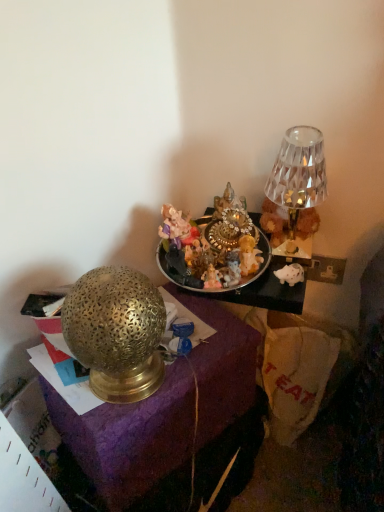
The image size is (384, 512). Describe the element at coordinates (134, 444) in the screenshot. I see `gold textured lamp at left` at that location.

Locate an element on the screen. The image size is (384, 512). gold textured lamp at left is located at coordinates (134, 444).

Is shiny metallic tray at center inside or outside of crystal glass lamp at upper right?

shiny metallic tray at center lies outside crystal glass lamp at upper right.

Which is more to the right, shiny metallic tray at center or crystal glass lamp at upper right?

Positioned to the right is crystal glass lamp at upper right.

Based on the photo, from the image's perspective, is shiny metallic tray at center located above crystal glass lamp at upper right?

No.

Is gold textured lamp at left smaller than shiny metallic tray at center?

Actually, gold textured lamp at left might be larger than shiny metallic tray at center.

Between gold textured lamp at left and shiny metallic tray at center, which one has smaller width?

shiny metallic tray at center.

How far apart are gold textured lamp at left and shiny metallic tray at center?

A distance of 12.00 inches exists between gold textured lamp at left and shiny metallic tray at center.

Considering the sizes of objects crystal glass lamp at upper right and gold textured lamp at left in the image provided, who is wider, crystal glass lamp at upper right or gold textured lamp at left?

With larger width is gold textured lamp at left.

Does point (322, 151) lie behind point (80, 419)?

Yes, it is.

Locate an element on the screen. Image resolution: width=384 pixels, height=512 pixels. lamp above the gold textured lamp at left (from the image's perspective) is located at coordinates (298, 178).

From the image's perspective, between shiny metallic tray at center and gold textured lamp at left, who is located below?

gold textured lamp at left appears lower in the image.

Can you see shiny metallic tray at center touching gold textured lamp at left?

Result: No.

From a real-world perspective, is shiny metallic tray at center over gold textured lamp at left?

Correct, in the physical world, shiny metallic tray at center is higher than gold textured lamp at left.

From the image's perspective, is crystal glass lamp at upper right positioned above or below shiny metallic tray at center?

Based on their image positions, crystal glass lamp at upper right is located above shiny metallic tray at center.

Is crystal glass lamp at upper right wider or thinner than shiny metallic tray at center?

Considering their sizes, crystal glass lamp at upper right looks slimmer than shiny metallic tray at center.

From a real-world perspective, is gold textured lamp at left positioned above or below crystal glass lamp at upper right?

Clearly, from a real-world perspective, gold textured lamp at left is below crystal glass lamp at upper right.

Which is more to the left, gold textured lamp at left or crystal glass lamp at upper right?

gold textured lamp at left.

Is crystal glass lamp at upper right surrounded by gold textured lamp at left?

That's incorrect, crystal glass lamp at upper right is not inside gold textured lamp at left.

Is gold textured lamp at left oriented towards crystal glass lamp at upper right?

No, gold textured lamp at left is not oriented towards crystal glass lamp at upper right.

Identify the location of lamp lying above the shiny metallic tray at center (from the image's perspective). (298, 178).

The width and height of the screenshot is (384, 512). In order to click on tableware that appears above the gold textured lamp at left (from a real-world perspective) in this screenshot , I will do `click(219, 288)`.

Which object lies nearer to the anchor point shiny metallic tray at center, crystal glass lamp at upper right or gold textured lamp at left?

Based on the image, crystal glass lamp at upper right appears to be nearer to shiny metallic tray at center.

Estimate the real-world distances between objects in this image. Which object is further from shiny metallic tray at center, gold textured lamp at left or crystal glass lamp at upper right?

The object further to shiny metallic tray at center is gold textured lamp at left.

Considering their positions, is gold textured lamp at left positioned further to crystal glass lamp at upper right than shiny metallic tray at center?

The object further to crystal glass lamp at upper right is gold textured lamp at left.

Estimate the real-world distances between objects in this image. Which object is further from gold textured lamp at left, shiny metallic tray at center or crystal glass lamp at upper right?

Among the two, crystal glass lamp at upper right is located further to gold textured lamp at left.

From the image, which object appears to be nearer to crystal glass lamp at upper right, shiny metallic tray at center or gold textured lamp at left?

The object closer to crystal glass lamp at upper right is shiny metallic tray at center.

Looking at this image, estimate the real-world distances between objects in this image. Which object is closer to gold textured lamp at left, crystal glass lamp at upper right or shiny metallic tray at center?

Among the two, shiny metallic tray at center is located nearer to gold textured lamp at left.

Find the location of `tableware that lies between crystal glass lamp at upper right and gold textured lamp at left from top to bottom`. tableware that lies between crystal glass lamp at upper right and gold textured lamp at left from top to bottom is located at coordinates (219, 288).